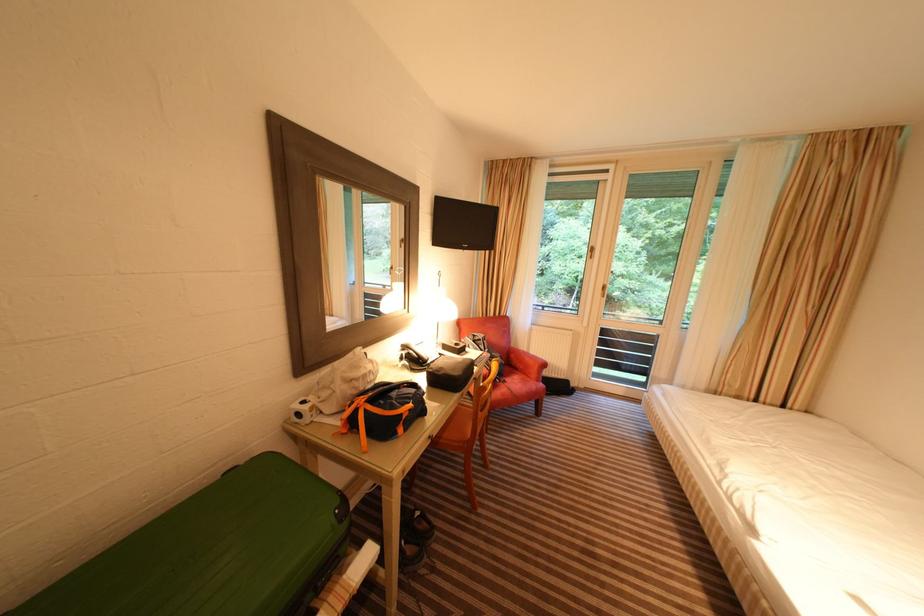
Where is `red chair armrest`? The width and height of the screenshot is (924, 616). red chair armrest is located at coordinates (526, 362).